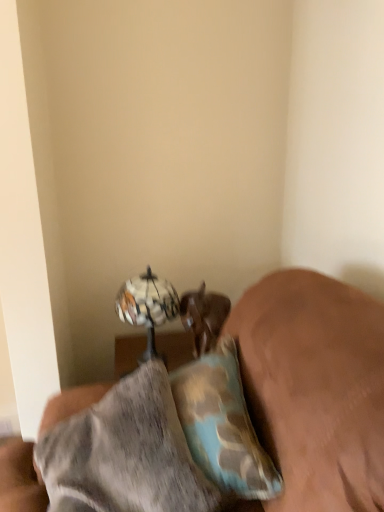
Question: Are metallic reflective globe at upper center and camouflage fabric pillow at lower right located far from each other?

Choices:
 (A) yes
 (B) no

Answer: (B)

Question: Does metallic reflective globe at upper center have a greater width compared to camouflage fabric pillow at lower right?

Choices:
 (A) yes
 (B) no

Answer: (A)

Question: Is metallic reflective globe at upper center to the left of camouflage fabric pillow at lower right from the viewer's perspective?

Choices:
 (A) no
 (B) yes

Answer: (B)

Question: Is metallic reflective globe at upper center looking in the opposite direction of camouflage fabric pillow at lower right?

Choices:
 (A) no
 (B) yes

Answer: (A)

Question: Can you confirm if metallic reflective globe at upper center is taller than camouflage fabric pillow at lower right?

Choices:
 (A) yes
 (B) no

Answer: (A)

Question: Does metallic reflective globe at upper center come in front of camouflage fabric pillow at lower right?

Choices:
 (A) no
 (B) yes

Answer: (A)

Question: From a real-world perspective, is camouflage fabric pillow at lower right under metallic reflective globe at upper center?

Choices:
 (A) yes
 (B) no

Answer: (B)

Question: Is camouflage fabric pillow at lower right turned away from metallic reflective globe at upper center?

Choices:
 (A) yes
 (B) no

Answer: (B)

Question: Considering the relative positions of camouflage fabric pillow at lower right and metallic reflective globe at upper center in the image provided, is camouflage fabric pillow at lower right to the left of metallic reflective globe at upper center from the viewer's perspective?

Choices:
 (A) yes
 (B) no

Answer: (B)

Question: From the image's perspective, is camouflage fabric pillow at lower right above metallic reflective globe at upper center?

Choices:
 (A) yes
 (B) no

Answer: (B)

Question: Is the position of camouflage fabric pillow at lower right less distant than that of metallic reflective globe at upper center?

Choices:
 (A) no
 (B) yes

Answer: (B)

Question: From the image's perspective, is camouflage fabric pillow at lower right beneath metallic reflective globe at upper center?

Choices:
 (A) no
 (B) yes

Answer: (B)

Question: From a real-world perspective, does brown leather dog at lower center stand above camouflage fabric pillow at lower right?

Choices:
 (A) yes
 (B) no

Answer: (B)